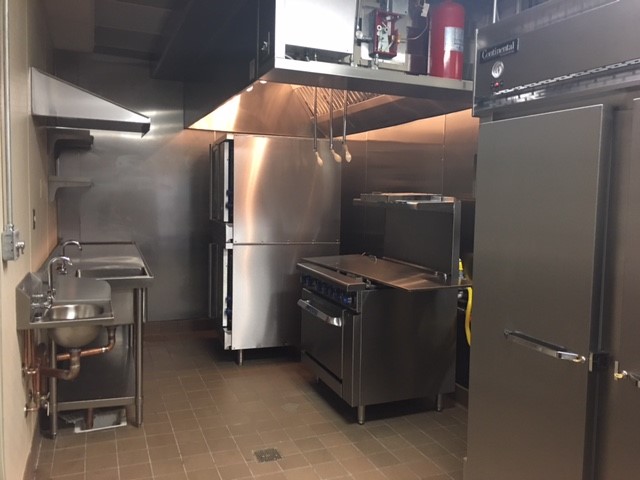
What are the coordinates of `sink` in the screenshot? It's located at (77, 316), (90, 272).